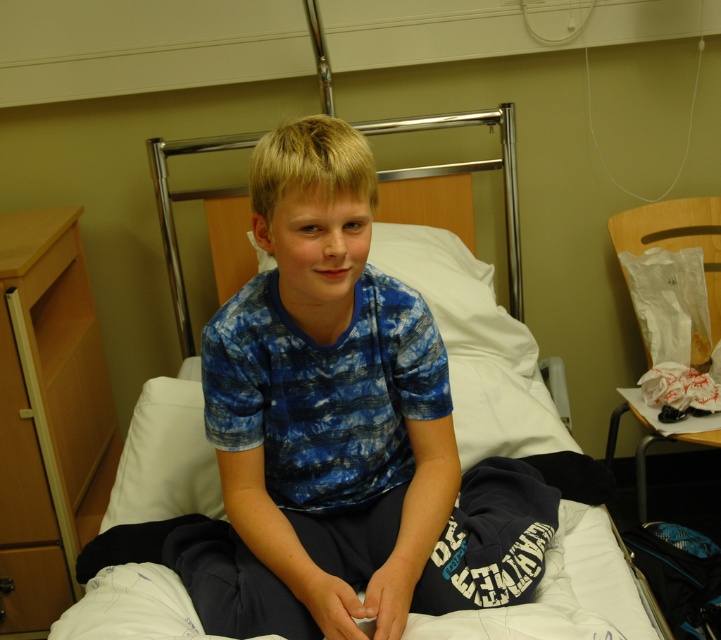
You are a nurse in the hospital room and need to place a small medical kit. You have two points to choose from. The first point is at coordinate point(329, 403) and the second is at point(451, 346). Which point is closer to you?

Point(329, 403) is closer to the viewer than point(451, 346), so you should choose the first point.